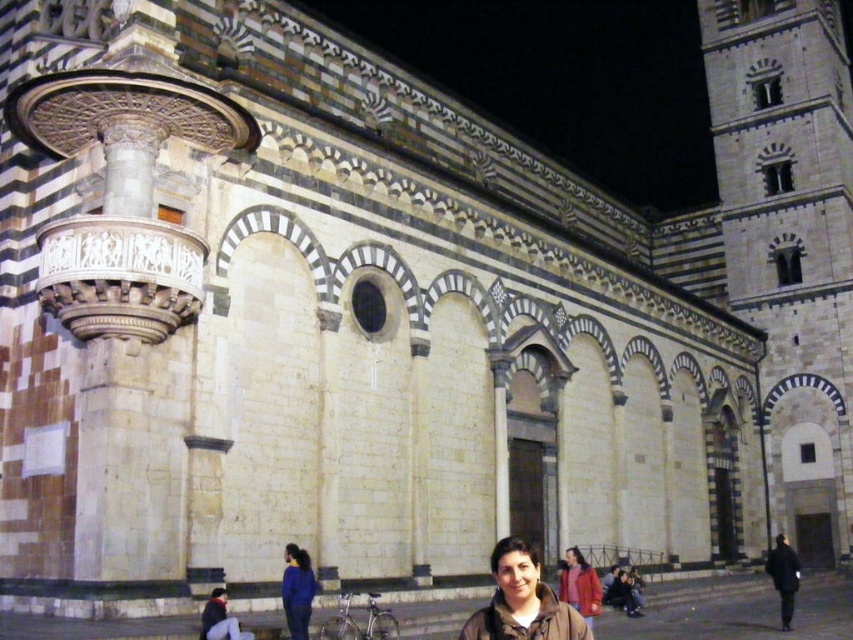
Question: Which point appears farthest from the camera in this image?

Choices:
 (A) (737, 262)
 (B) (283, 586)

Answer: (A)

Question: In this image, where is blue fabric jacket at lower center located relative to red woolen coat at lower center?

Choices:
 (A) right
 (B) left

Answer: (B)

Question: Which object appears farthest from the camera in this image?

Choices:
 (A) red woolen coat at lower center
 (B) blue fabric jacket at lower center
 (C) dark gray fabric coat at lower right
 (D) gray stone tower at right

Answer: (D)

Question: Considering the relative positions of blue fabric jacket at lower center and red woolen coat at lower center in the image provided, where is blue fabric jacket at lower center located with respect to red woolen coat at lower center?

Choices:
 (A) right
 (B) left

Answer: (B)

Question: Which point is closer to the camera?

Choices:
 (A) dark gray fabric coat at lower right
 (B) gray stone tower at right
 (C) red woolen coat at lower center
 (D) matte brown jacket at lower center

Answer: (D)

Question: Is gray stone tower at right to the right of blue fabric jacket at lower center from the viewer's perspective?

Choices:
 (A) no
 (B) yes

Answer: (B)